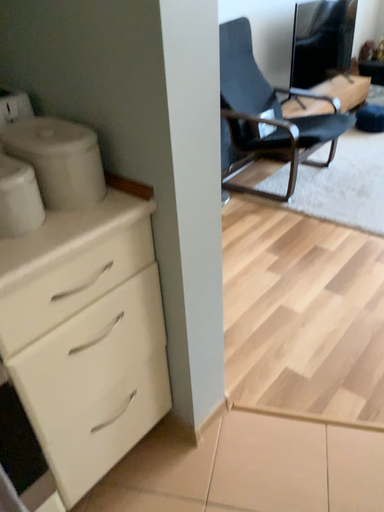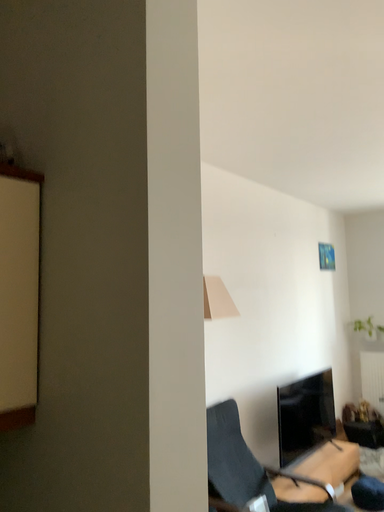
Question: Which way did the camera rotate in the video?

Choices:
 (A) rotated downward
 (B) rotated upward

Answer: (B)